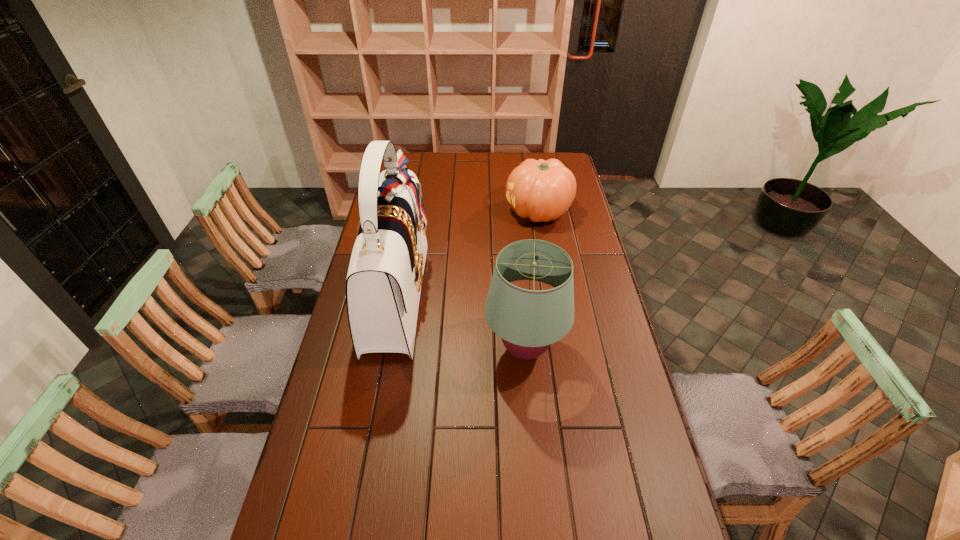
This screenshot has height=540, width=960. Find the location of `the leftmost object`. the leftmost object is located at coordinates (385, 275).

Where is `satchel`? satchel is located at coordinates (385, 275).

You are a GUI agent. You are given a task and a screenshot of the screen. Output one action in this format:
    pyautogui.click(x=<x>, y=<y>)
    Task: Click on the lampshade
    
    Given the screenshot: What is the action you would take?
    [528, 321]

Where is `the shortest object`? The image size is (960, 540). the shortest object is located at coordinates (540, 190).

The height and width of the screenshot is (540, 960). I want to click on pumpkin, so click(540, 190).

At what (x,y) coordinates should I click in order to perform the action: click on free location located on the front-facing side of the leftmost object. Please return your answer as a coordinate pair (x, y). Looking at the image, I should click on (464, 294).

Where is `vacant space situated on the right of the lampshade`? This screenshot has height=540, width=960. vacant space situated on the right of the lampshade is located at coordinates (603, 349).

This screenshot has height=540, width=960. Identify the location of vacant space situated on the carved face of the shortest object. (464, 212).

What are the coordinates of `free space located on the carved face of the shortest object` in the screenshot? It's located at (432, 212).

Find the location of `free region located 0.360m on the carved face of the shortest object`. free region located 0.360m on the carved face of the shortest object is located at coordinates click(x=423, y=212).